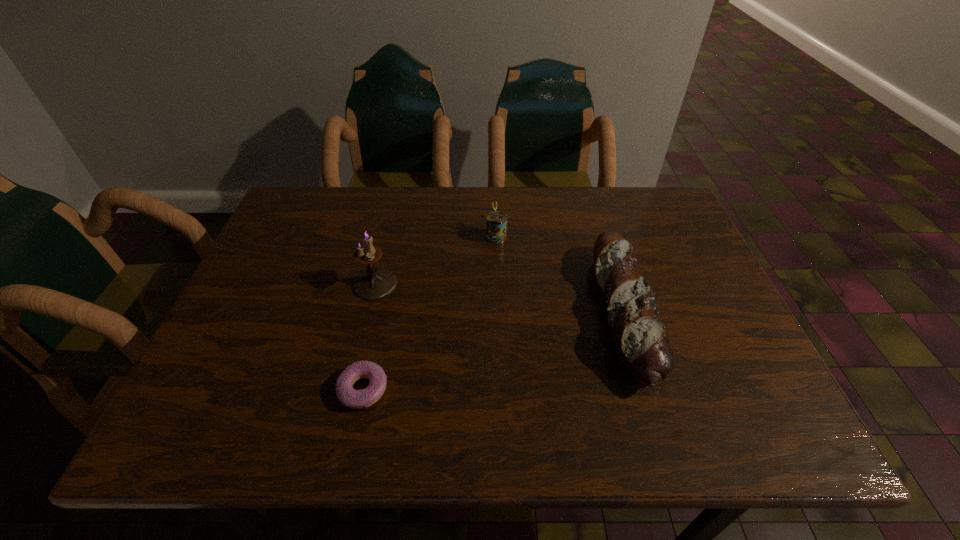
Find the location of a particular element. The height and width of the screenshot is (540, 960). free space between the baguet and the farthest object is located at coordinates (560, 274).

What are the coordinates of `vacant area between the can and the doughnut` in the screenshot? It's located at point(429,313).

Locate an element on the screen. The image size is (960, 540). free space between the tallest object and the shortest object is located at coordinates (369, 336).

Where is `free spot between the farthest object and the rightmost object`? free spot between the farthest object and the rightmost object is located at coordinates (560, 274).

Locate an element on the screen. The height and width of the screenshot is (540, 960). vacant area between the rightmost object and the candle holder is located at coordinates (499, 298).

Locate an element on the screen. free space between the rightmost object and the tallest object is located at coordinates (499, 298).

At what (x,y) coordinates should I click in order to perform the action: click on vacant region between the second object from right to left and the baguet. Please return your answer as a coordinate pair (x, y). The height and width of the screenshot is (540, 960). Looking at the image, I should click on (560, 274).

You are a GUI agent. You are given a task and a screenshot of the screen. Output one action in this format:
    pyautogui.click(x=<x>, y=<y>)
    Task: Click on the object that ranks as the second closest to the second object from right to left
    The height and width of the screenshot is (540, 960).
    Given the screenshot: What is the action you would take?
    pyautogui.click(x=374, y=283)

This screenshot has height=540, width=960. Find the location of `the third closest object to the baguet`. the third closest object to the baguet is located at coordinates (374, 283).